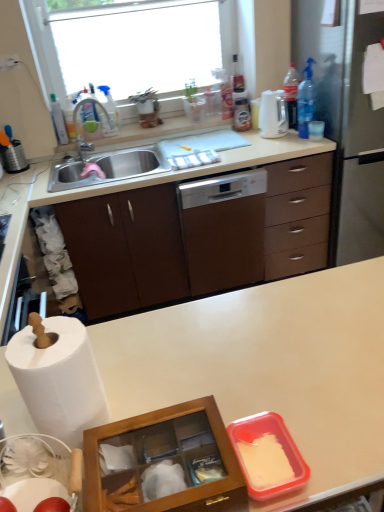
Question: From the image's perspective, would you say transparent glass window at upper center is shown under white matte countertop at center?

Choices:
 (A) no
 (B) yes

Answer: (A)

Question: Can you confirm if transparent glass window at upper center is thinner than white matte countertop at center?

Choices:
 (A) no
 (B) yes

Answer: (B)

Question: Is the position of transparent glass window at upper center less distant than that of white matte countertop at center?

Choices:
 (A) no
 (B) yes

Answer: (A)

Question: Is transparent glass window at upper center facing away from white matte countertop at center?

Choices:
 (A) yes
 (B) no

Answer: (B)

Question: Does transparent glass window at upper center appear on the left side of white matte countertop at center?

Choices:
 (A) yes
 (B) no

Answer: (A)

Question: Is brown wood cabinet at left situated inside transparent plastic spray bottle at upper left, positioned as the 3th bottle in right-to-left order, or outside?

Choices:
 (A) inside
 (B) outside

Answer: (B)

Question: Is point (71, 233) closer or farther from the camera than point (114, 117)?

Choices:
 (A) closer
 (B) farther

Answer: (A)

Question: From a real-world perspective, relative to transparent plastic spray bottle at upper left, the 2th bottle when ordered from left to right, is brown wood cabinet at left vertically above or below?

Choices:
 (A) below
 (B) above

Answer: (A)

Question: Considering the positions of brown wood cabinet at left and transparent plastic spray bottle at upper left, the 2th bottle when ordered from left to right, in the image, is brown wood cabinet at left taller or shorter than transparent plastic spray bottle at upper left, the 2th bottle when ordered from left to right,?

Choices:
 (A) tall
 (B) short

Answer: (A)

Question: From their relative heights in the image, would you say matte silver faucet at sink left is taller or shorter than white glossy electric kettle at upper right?

Choices:
 (A) short
 (B) tall

Answer: (B)

Question: Is point pos(109,117) positioned closer to the camera than point pos(276,119)?

Choices:
 (A) farther
 (B) closer

Answer: (A)

Question: Is matte silver faucet at sink left to the left or to the right of white glossy electric kettle at upper right in the image?

Choices:
 (A) left
 (B) right

Answer: (A)

Question: Is matte silver faucet at sink left inside the boundaries of white glossy electric kettle at upper right, or outside?

Choices:
 (A) outside
 (B) inside

Answer: (A)

Question: Considering the positions of white glossy dishwasher at center and brushed metal grater at left in the image, is white glossy dishwasher at center bigger or smaller than brushed metal grater at left?

Choices:
 (A) big
 (B) small

Answer: (A)

Question: Is white glossy dishwasher at center situated inside brushed metal grater at left or outside?

Choices:
 (A) outside
 (B) inside

Answer: (A)